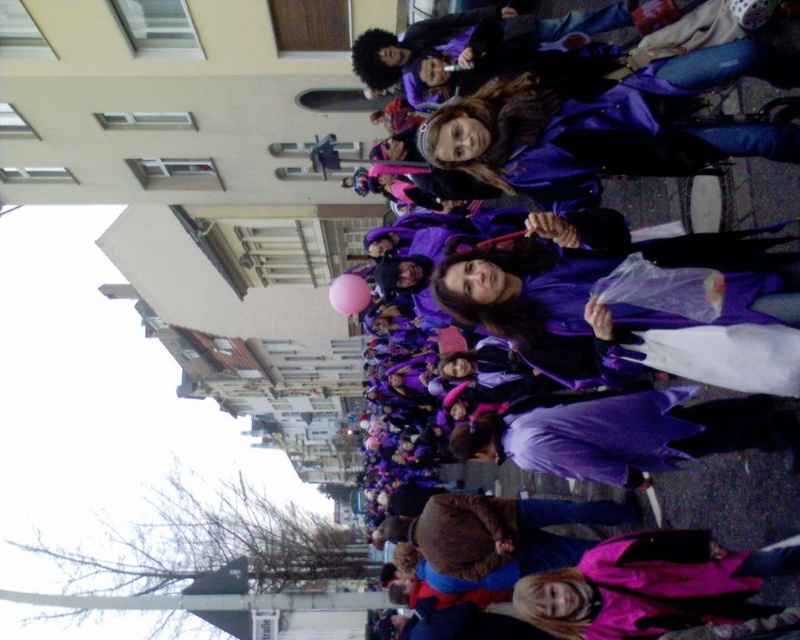
You are standing at the origin point of the image coordinate system. You want to walk towards the point labeled as point [454,337]. However, there is an obstacle at point [556,508]. Will you encounter the obstacle before reaching your destination?

Yes, you will encounter the obstacle at point [556,508] before reaching the destination point [454,337] because the obstacle is in front of the destination point according to the coordinate system.

You are standing on the street and want to take a photo of the point at coordinates point (462, 573). If your camera can focus on objects up to 50 meters away, will you be able to capture the point clearly?

The distance of point (462, 573) from the viewer is 45.27 meters, which is within the camera focus range of up to 50 meters. Therefore, you can capture the point clearly.